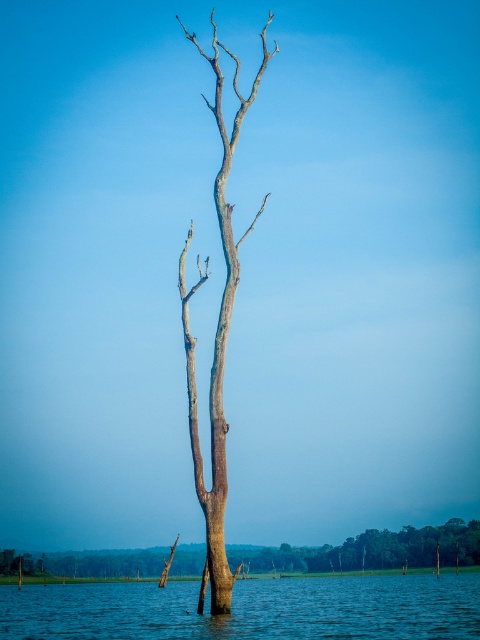
You are a small boat floating on the blue liquid water at center. You want to reach the smooth gray bark tree at center. Is the tree taller than the water around it?

The blue liquid water at center has a lesser height compared to smooth gray bark tree at center, so yes, the smooth gray bark tree at center is taller than the blue liquid water at center.